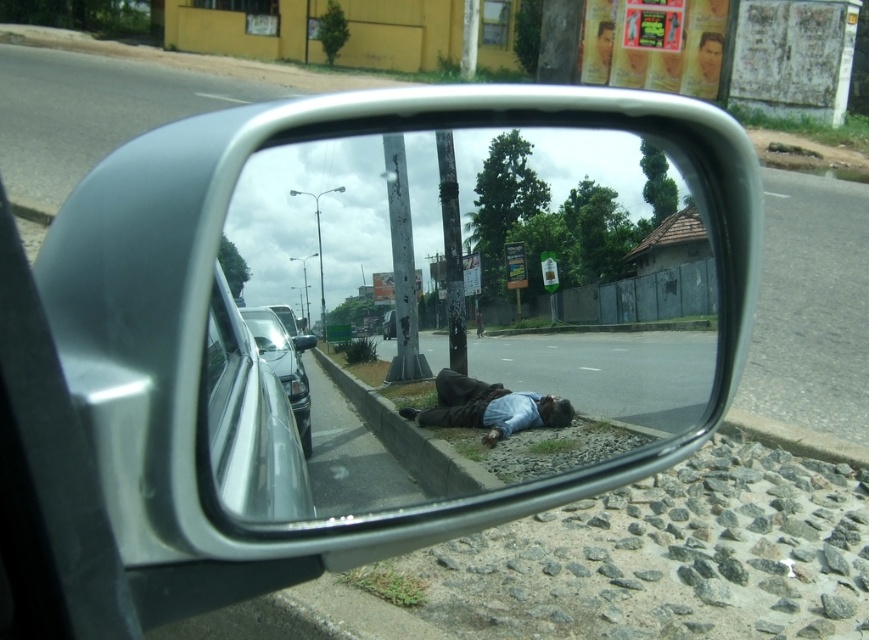
You are inside a car and looking at the side mirror. You notice a clear glass car window at lower left in the reflection. Where exactly is this window positioned in the mirror? Please provide the coordinates from the mirror frame as a point in the format like point x, y.

The clear glass car window at lower left is located at point (251, 413) according to the mirror frame coordinates.

You are a driver checking your side mirror and notice a point at coordinates (488, 406). What object is located at this position in the mirror?

The point at coordinates (488, 406) indicates the dark blue fabric man at lower center.

You are a driver checking your side mirror and see the dark blue fabric man at lower center and the shiny silver car at lower left in the reflection. Which object is closer to the right edge of the mirror?

The dark blue fabric man at lower center is positioned on the right side of the shiny silver car at lower left, so the dark blue fabric man at lower center is closer to the right edge of the mirror.